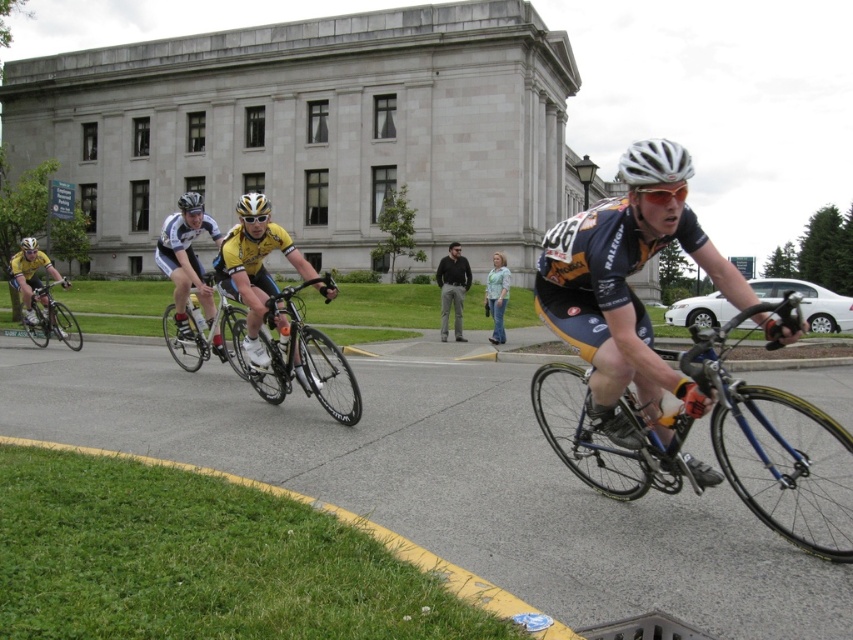
Does point (25, 282) lie behind point (445, 273)?

No.

The image size is (853, 640). I want to click on yellow jersey at center, so click(x=32, y=276).

Is point (51, 269) farther from viewer compared to point (457, 321)?

No, it is not.

The height and width of the screenshot is (640, 853). I want to click on yellow jersey at center, so click(32, 276).

Does shiny silver bicycle at left appear on the right side of yellow jersey at center?

Indeed, shiny silver bicycle at left is positioned on the right side of yellow jersey at center.

Is shiny silver bicycle at left above yellow jersey at center?

Answer: No.

Does point (36, 328) lie behind point (41, 292)?

That is True.

Image resolution: width=853 pixels, height=640 pixels. I want to click on shiny silver bicycle at left, so click(51, 317).

Is point (235, 349) farther from viewer compared to point (502, 324)?

No, (235, 349) is in front of (502, 324).

Can you confirm if shiny black bicycle at center is positioned to the right of light green fabric shirt at lower center?

Incorrect, shiny black bicycle at center is not on the right side of light green fabric shirt at lower center.

Locate an element on the screen. The height and width of the screenshot is (640, 853). shiny black bicycle at center is located at coordinates (299, 356).

The image size is (853, 640). Identify the location of shiny black bicycle at center. (299, 356).